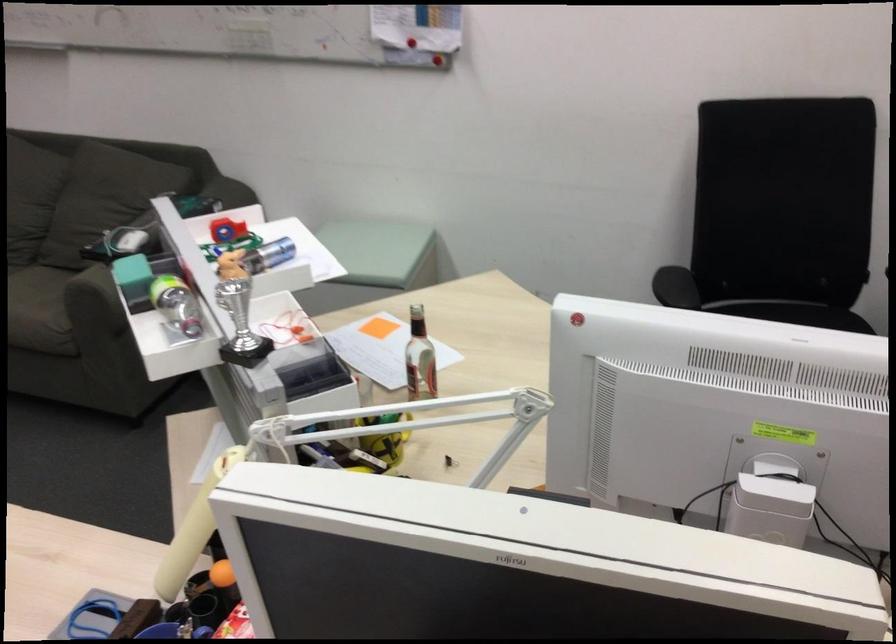
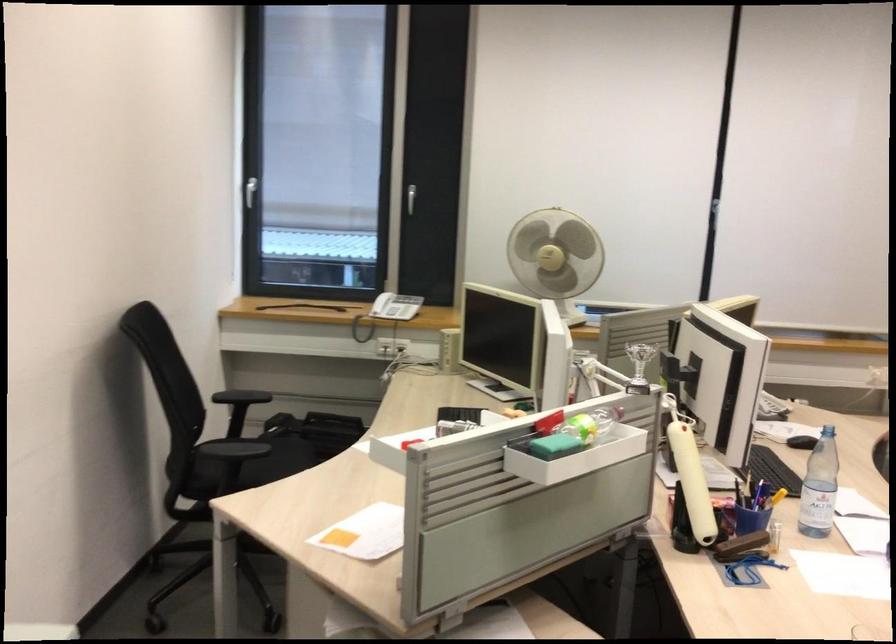
Question: I am providing you with two images of the same scene from different viewpoints. Which of the following objects are not visible in image2?

Choices:
 (A) small silver trophy
 (B) white lamp arm
 (C) black zipper pouch
 (D) black chair armrest

Answer: (B)